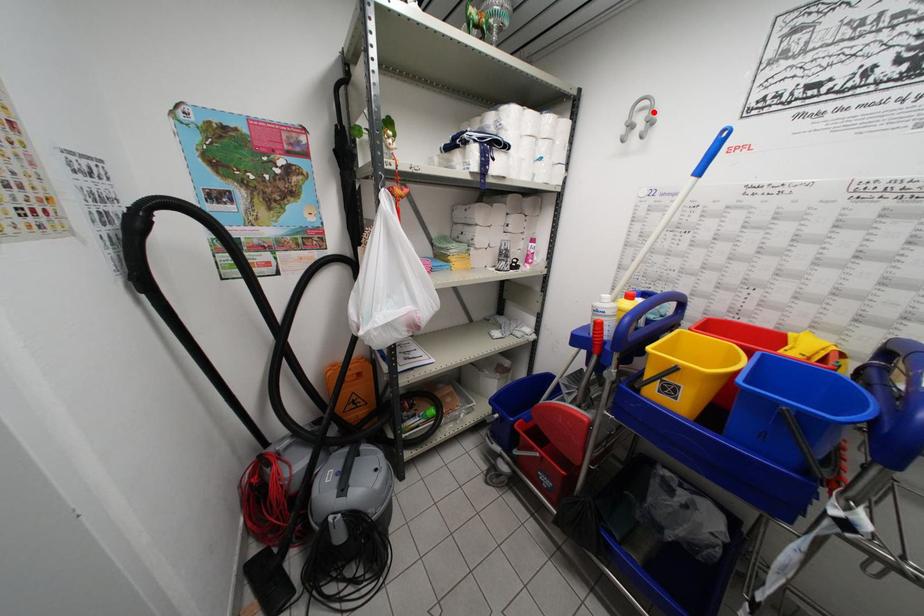
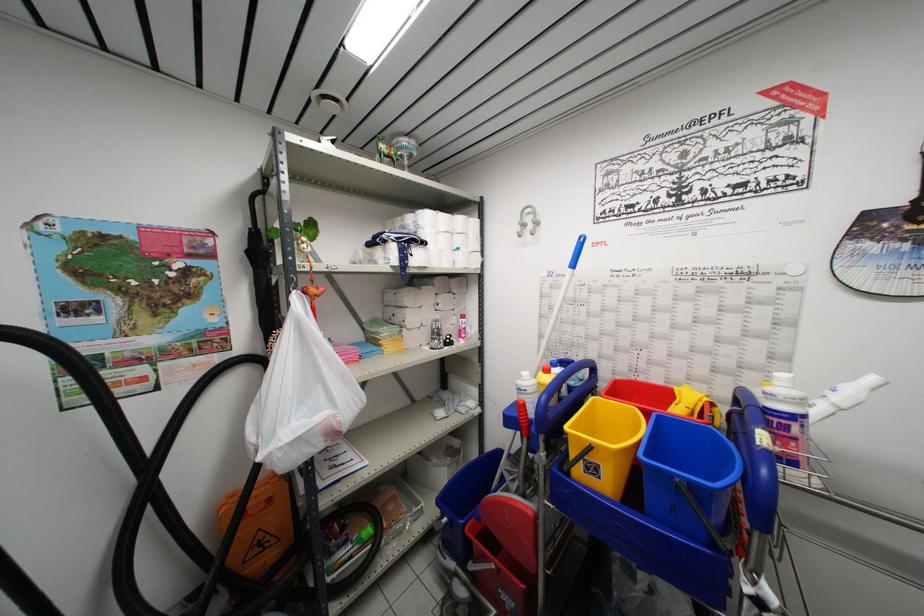
The point at the highlighted location is marked in the first image. Where is the corresponding point in the second image?

(537, 217)